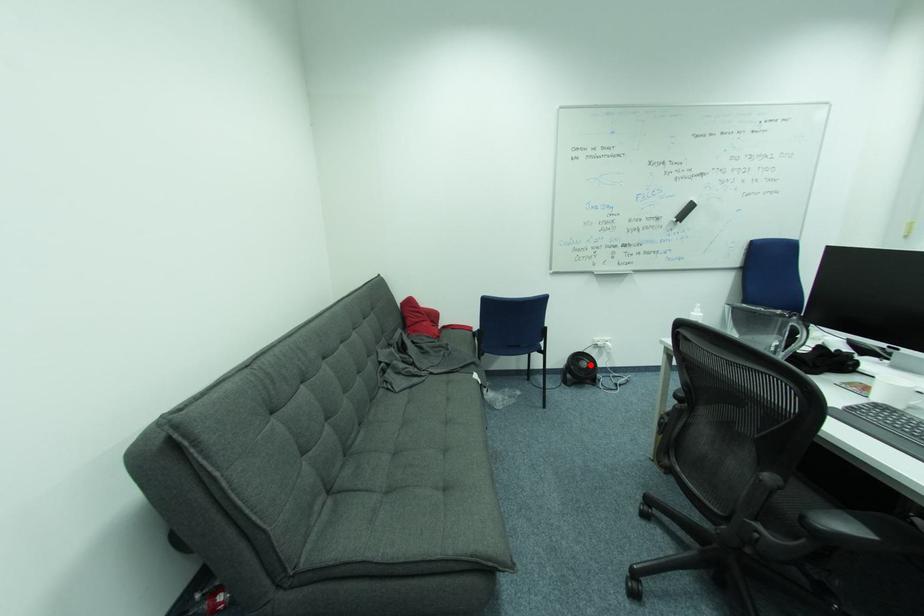
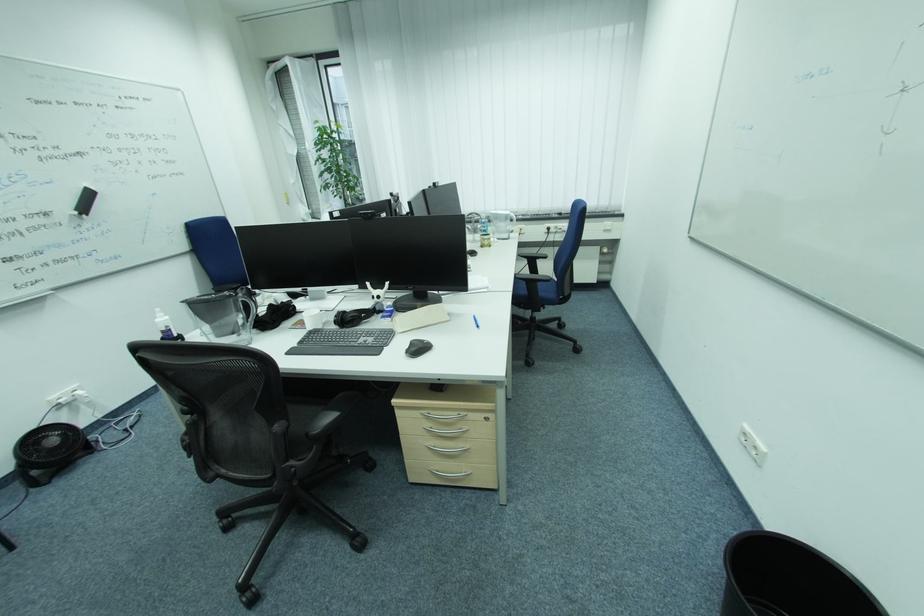
Locate, in the second image, the point that corresponds to the highlighted location in the first image.

(59, 442)